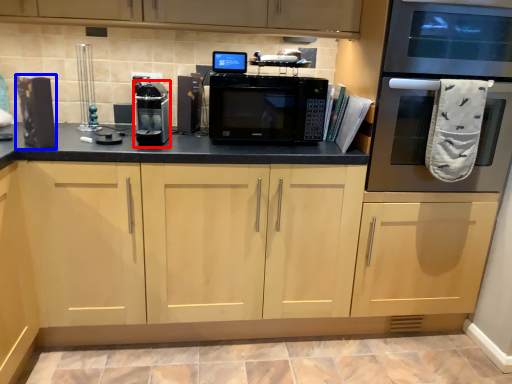
Question: Among these objects, which one is nearest to the camera, appliance (highlighted by a red box) or appliance (highlighted by a blue box)?

Choices:
 (A) appliance
 (B) appliance

Answer: (B)